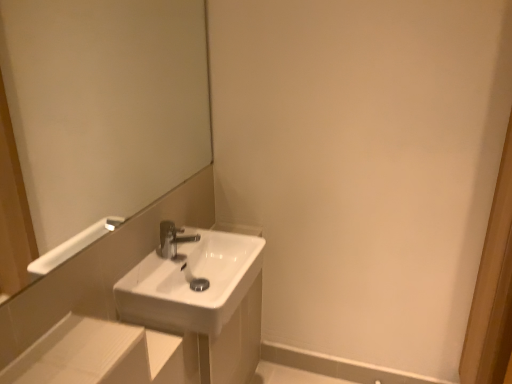
Measure the distance between white glossy mirror at upper left and camera.

white glossy mirror at upper left and camera are 1.66 meters apart from each other.

Describe the element at coordinates (104, 105) in the screenshot. The width and height of the screenshot is (512, 384). I see `white glossy mirror at upper left` at that location.

Measure the distance between point (x=176, y=43) and camera.

Point (x=176, y=43) and camera are 5.72 feet apart from each other.

The image size is (512, 384). Identify the location of white glossy mirror at upper left. (104, 105).

This screenshot has height=384, width=512. I want to click on white glossy sink at center, so click(189, 284).

This screenshot has height=384, width=512. What do you see at coordinates (189, 284) in the screenshot? I see `white glossy sink at center` at bounding box center [189, 284].

In order to face white glossy sink at center, should I rotate leftwards or rightwards?

You should look left and rotate roughly 6.798 degrees.

Locate an element on the screen. Image resolution: width=512 pixels, height=384 pixels. white glossy mirror at upper left is located at coordinates (104, 105).

Does white glossy mirror at upper left appear on the right side of white glossy sink at center?

Incorrect, white glossy mirror at upper left is not on the right side of white glossy sink at center.

Is white glossy mirror at upper left in front of or behind white glossy sink at center in the image?

white glossy mirror at upper left is in front of white glossy sink at center.

Considering the positions of points (167, 27) and (213, 231), is point (167, 27) closer to camera compared to point (213, 231)?

Yes, it is.

From the image's perspective, relative to white glossy sink at center, is white glossy mirror at upper left above or below?

white glossy mirror at upper left is above white glossy sink at center.

From a real-world perspective, who is located higher, white glossy mirror at upper left or white glossy sink at center?

In real-world perspective, white glossy mirror at upper left is above.

Does white glossy mirror at upper left have a greater width compared to white glossy sink at center?

Incorrect, the width of white glossy mirror at upper left does not surpass that of white glossy sink at center.

Does white glossy mirror at upper left have a greater height compared to white glossy sink at center?

Yes.

Considering the sizes of white glossy mirror at upper left and white glossy sink at center in the image, is white glossy mirror at upper left bigger or smaller than white glossy sink at center?

Clearly, white glossy mirror at upper left is larger in size than white glossy sink at center.

Is white glossy mirror at upper left outside of white glossy sink at center?

Absolutely, white glossy mirror at upper left is external to white glossy sink at center.

Is white glossy mirror at upper left far from white glossy sink at center?

Actually, white glossy mirror at upper left and white glossy sink at center are a little close together.

Is white glossy sink at center at the back of white glossy mirror at upper left?

No, white glossy mirror at upper left's orientation is not away from white glossy sink at center.

Can you tell me how much white glossy mirror at upper left and white glossy sink at center differ in facing direction?

There is a 0.371-degree angle between the facing directions of white glossy mirror at upper left and white glossy sink at center.

Measure the distance between white glossy mirror at upper left and white glossy sink at center.

white glossy mirror at upper left is 31.09 inches from white glossy sink at center.

Locate an element on the screen. mirror on the left of the white glossy sink at center is located at coordinates (104, 105).

Is white glossy sink at center at the right side of white glossy mirror at upper left?

Indeed, white glossy sink at center is positioned on the right side of white glossy mirror at upper left.

Who is more distant, white glossy sink at center or white glossy mirror at upper left?

white glossy sink at center is behind.

Is point (127, 312) farther from camera compared to point (206, 87)?

No, it is in front of (206, 87).

From the image's perspective, is white glossy sink at center located above or below white glossy mirror at upper left?

white glossy sink at center is situated lower than white glossy mirror at upper left in the image.

From a real-world perspective, does white glossy sink at center sit lower than white glossy mirror at upper left?

Yes, from a real-world perspective, white glossy sink at center is under white glossy mirror at upper left.

Considering the sizes of white glossy sink at center and white glossy mirror at upper left in the image, is white glossy sink at center wider or thinner than white glossy mirror at upper left?

Clearly, white glossy sink at center has more width compared to white glossy mirror at upper left.

Which of these two, white glossy sink at center or white glossy mirror at upper left, stands shorter?

white glossy sink at center.

Considering the sizes of objects white glossy sink at center and white glossy mirror at upper left in the image provided, who is smaller, white glossy sink at center or white glossy mirror at upper left?

white glossy sink at center is smaller.

Can we say white glossy sink at center lies outside white glossy mirror at upper left?

Absolutely, white glossy sink at center is external to white glossy mirror at upper left.

Is white glossy sink at center next to white glossy mirror at upper left and touching it?

No, white glossy sink at center is not next to white glossy mirror at upper left.

Is white glossy sink at center oriented towards white glossy mirror at upper left?

No, white glossy sink at center is not turned towards white glossy mirror at upper left.

Looking at this image, what's the angular difference between white glossy sink at center and white glossy mirror at upper left's facing directions?

They differ by 0.371 degrees in their facing directions.

This screenshot has height=384, width=512. I want to click on mirror located in front of the white glossy sink at center, so click(x=104, y=105).

The height and width of the screenshot is (384, 512). I want to click on sink that is below the white glossy mirror at upper left (from the image's perspective), so click(x=189, y=284).

This screenshot has width=512, height=384. I want to click on sink beneath the white glossy mirror at upper left (from a real-world perspective), so (189, 284).